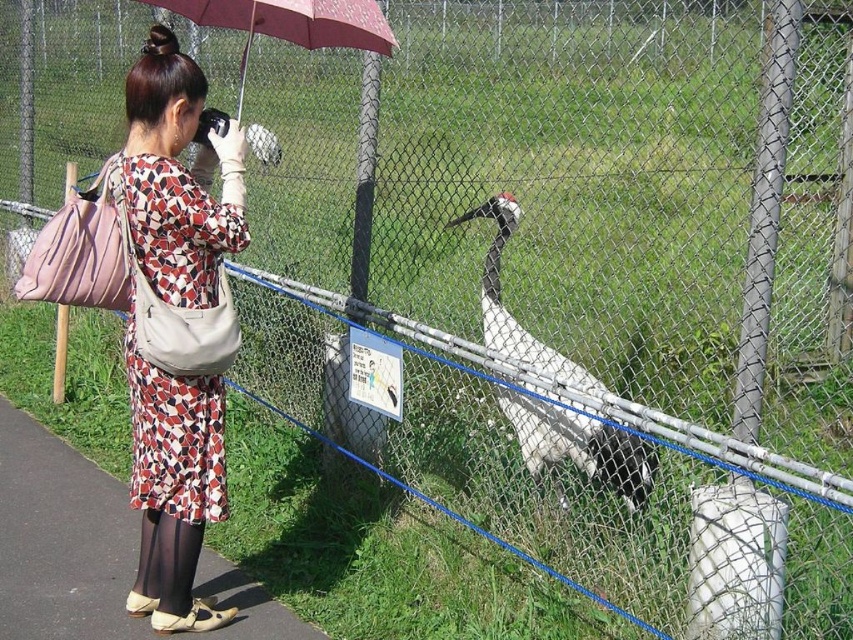
Is printed fabric dress at center to the left of white glossy bird at center from the viewer's perspective?

Yes, printed fabric dress at center is to the left of white glossy bird at center.

What are the coordinates of `printed fabric dress at center` in the screenshot? It's located at (178, 179).

Which is below, printed fabric dress at center or maroon fabric umbrella at upper center?

printed fabric dress at center

Is printed fabric dress at center positioned before maroon fabric umbrella at upper center?

No, printed fabric dress at center is further to the viewer.

Measure the distance between printed fabric dress at center and camera.

A distance of 2.59 meters exists between printed fabric dress at center and camera.

I want to click on printed fabric dress at center, so click(178, 179).

Can you confirm if white glossy bird at center is bigger than maroon fabric umbrella at upper center?

Yes, white glossy bird at center is bigger than maroon fabric umbrella at upper center.

Between point (590, 476) and point (142, 1), which one is positioned in front?

Positioned in front is point (590, 476).

At what (x,y) coordinates should I click in order to perform the action: click on white glossy bird at center. Please return your answer as a coordinate pair (x, y). The width and height of the screenshot is (853, 640). Looking at the image, I should click on (579, 445).